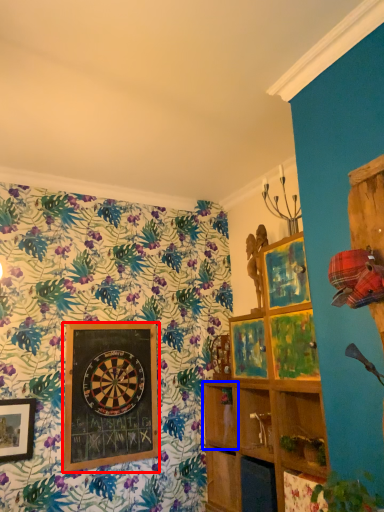
Question: Which object is further to the camera taking this photo, picture frame (highlighted by a red box) or shelf (highlighted by a blue box)?

Choices:
 (A) picture frame
 (B) shelf

Answer: (B)